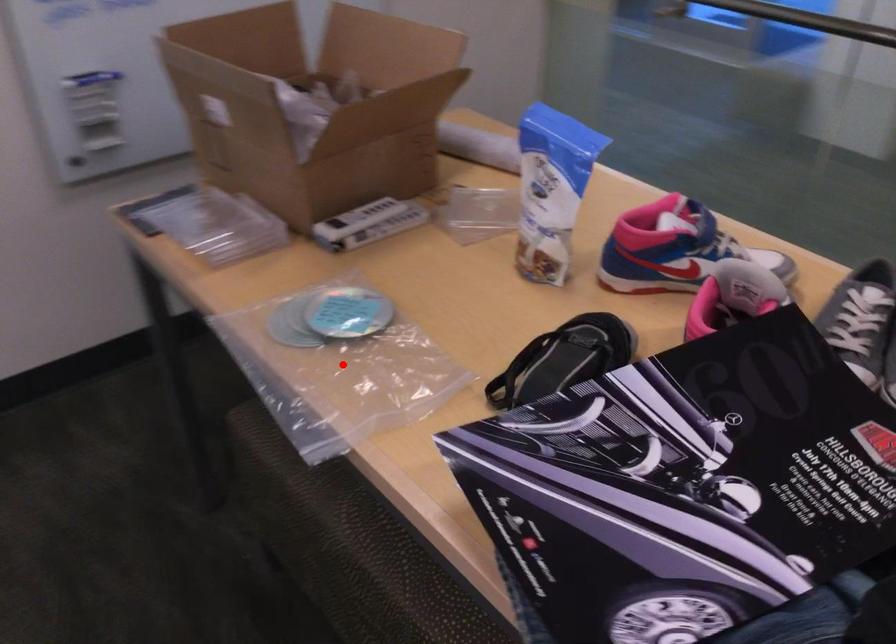
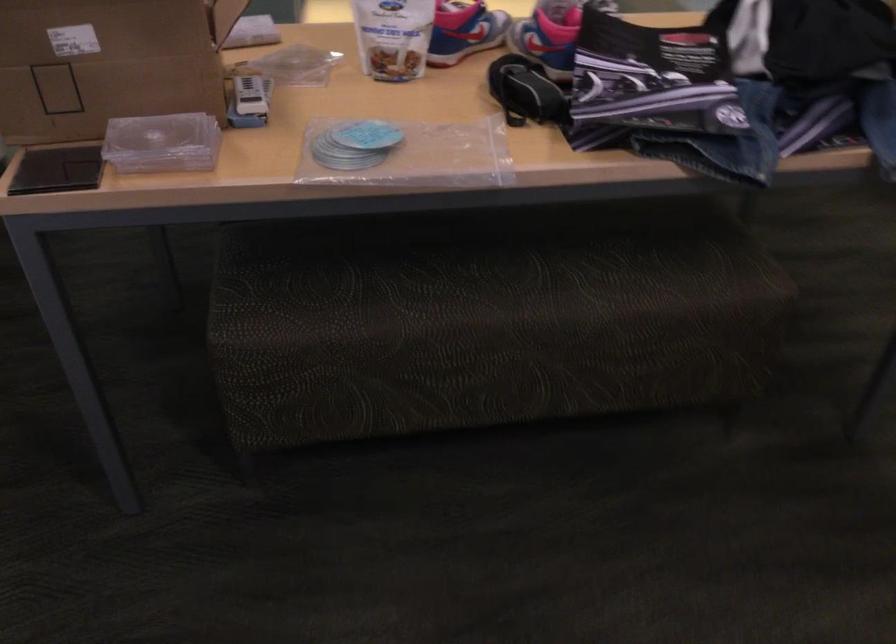
Question: A red point is marked in image1. In image2, is the corresponding 3D point closer to the camera or farther? Reply with the corresponding letter.

Choices:
 (A) The corresponding 3D point is closer.
 (B) The corresponding 3D point is farther.

Answer: (B)